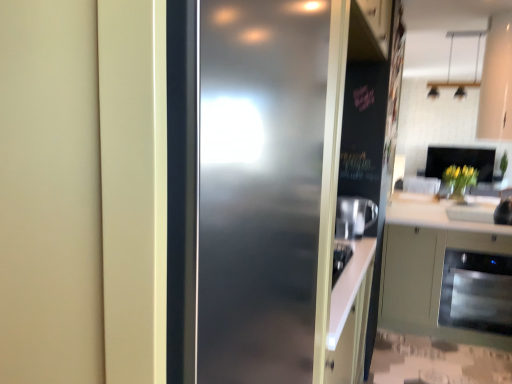
Question: Considering the relative sizes of translucent glass vase at center and white glossy sink at lower right in the image provided, is translucent glass vase at center shorter than white glossy sink at lower right?

Choices:
 (A) no
 (B) yes

Answer: (A)

Question: Considering the relative positions of translucent glass vase at center and white glossy sink at lower right in the image provided, is translucent glass vase at center to the right of white glossy sink at lower right from the viewer's perspective?

Choices:
 (A) yes
 (B) no

Answer: (A)

Question: Does translucent glass vase at center have a greater width compared to white glossy sink at lower right?

Choices:
 (A) no
 (B) yes

Answer: (A)

Question: Does translucent glass vase at center have a larger size compared to white glossy sink at lower right?

Choices:
 (A) no
 (B) yes

Answer: (A)

Question: Is translucent glass vase at center aimed at white glossy sink at lower right?

Choices:
 (A) yes
 (B) no

Answer: (A)

Question: From a real-world perspective, is translucent glass vase at center under white glossy sink at lower right?

Choices:
 (A) no
 (B) yes

Answer: (B)

Question: Considering the relative positions of yellow matte vase at right and white glossy sink at lower right in the image provided, is yellow matte vase at right to the left of white glossy sink at lower right from the viewer's perspective?

Choices:
 (A) no
 (B) yes

Answer: (A)

Question: Does yellow matte vase at right turn towards white glossy sink at lower right?

Choices:
 (A) yes
 (B) no

Answer: (B)

Question: Would you say yellow matte vase at right is a long distance from white glossy sink at lower right?

Choices:
 (A) yes
 (B) no

Answer: (B)

Question: Is yellow matte vase at right touching white glossy sink at lower right?

Choices:
 (A) no
 (B) yes

Answer: (A)

Question: Is yellow matte vase at right smaller than white glossy sink at lower right?

Choices:
 (A) no
 (B) yes

Answer: (A)

Question: From a real-world perspective, is yellow matte vase at right over white glossy sink at lower right?

Choices:
 (A) yes
 (B) no

Answer: (A)

Question: From the image's perspective, is sleek stainless steel dishwasher at lower right on top of matte white door at center?

Choices:
 (A) no
 (B) yes

Answer: (A)